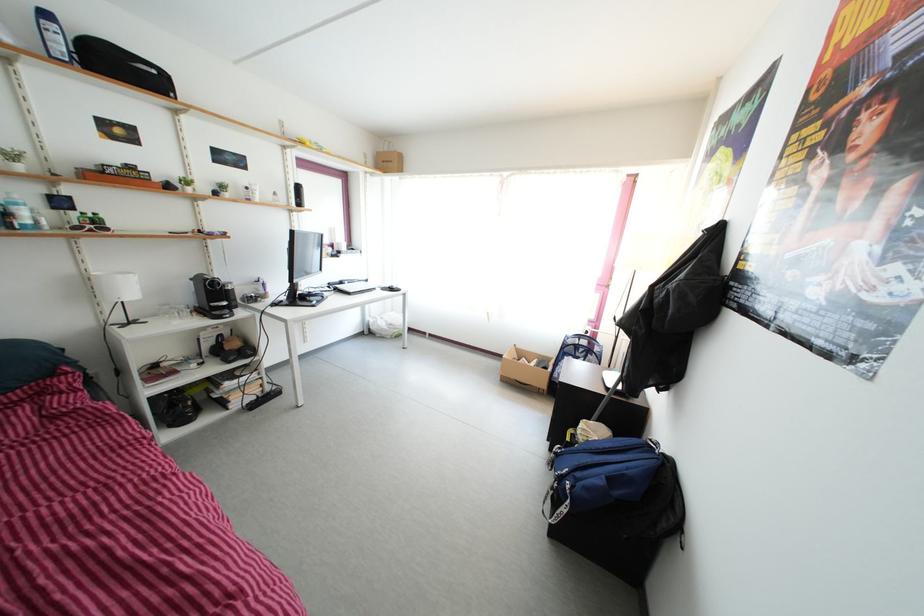
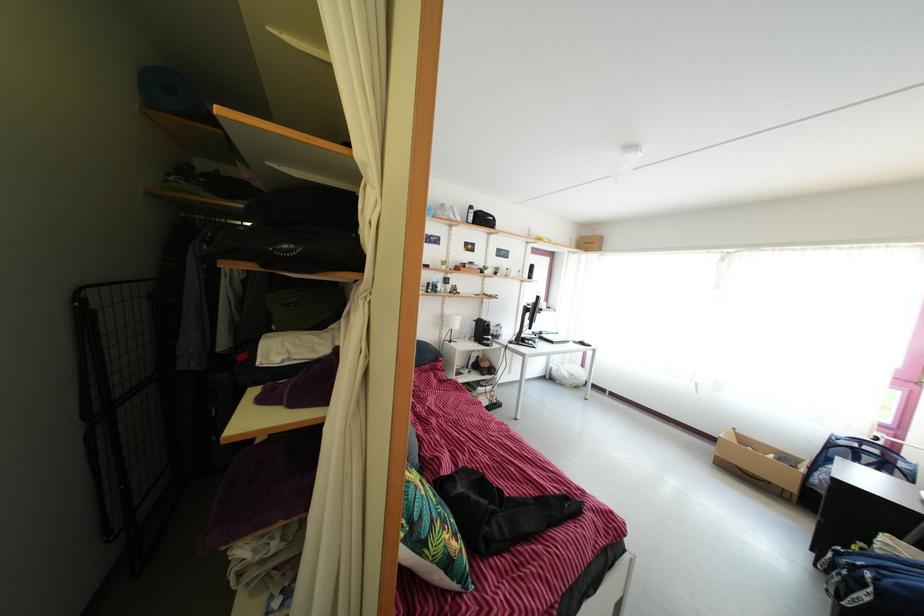
Where in the second image is the point corresponding to (555,368) from the first image?

(805, 468)